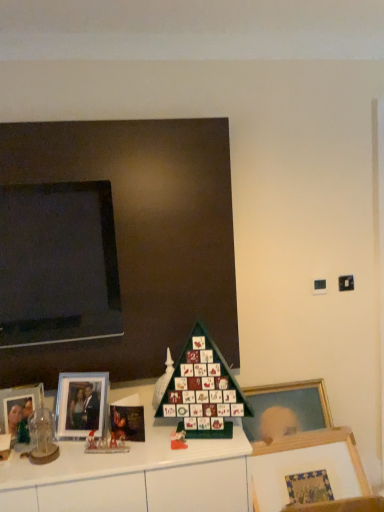
Question: Do you think matte black board at upper left is within matte plastic advent calendar at center, which ranks as the 1th toy in right-to-left order, or outside of it?

Choices:
 (A) outside
 (B) inside

Answer: (A)

Question: In the image, is matte black board at upper left on the left side or the right side of matte plastic advent calendar at center, which ranks as the 1th toy in right-to-left order?

Choices:
 (A) left
 (B) right

Answer: (A)

Question: Which of these objects is positioned farthest from the matte plastic advent calendar at center, the 3th toy when ordered from left to right?

Choices:
 (A) wooden picture frame at lower right, arranged as the 3th picture frame when viewed from the left
 (B) matte glass picture frame at left, which appears as the second picture frame when viewed from the right
 (C) green plastic advent calendar at center
 (D) matte black board at upper left
 (E) matte glass picture frame at left, acting as the 3th picture frame starting from the right

Answer: (D)

Question: Estimate the real-world distances between objects in this image. Which object is farther from the clear glass dome at left, arranged as the 3th toy when viewed from the right?

Choices:
 (A) matte glass picture frame at left, acting as the 3th picture frame starting from the right
 (B) green plastic advent calendar at center
 (C) green matte advent calendar at center, which ranks as the first toy in back-to-front order
 (D) matte glass picture frame at left, which appears as the second picture frame when viewed from the right
 (E) matte black board at upper left

Answer: (E)